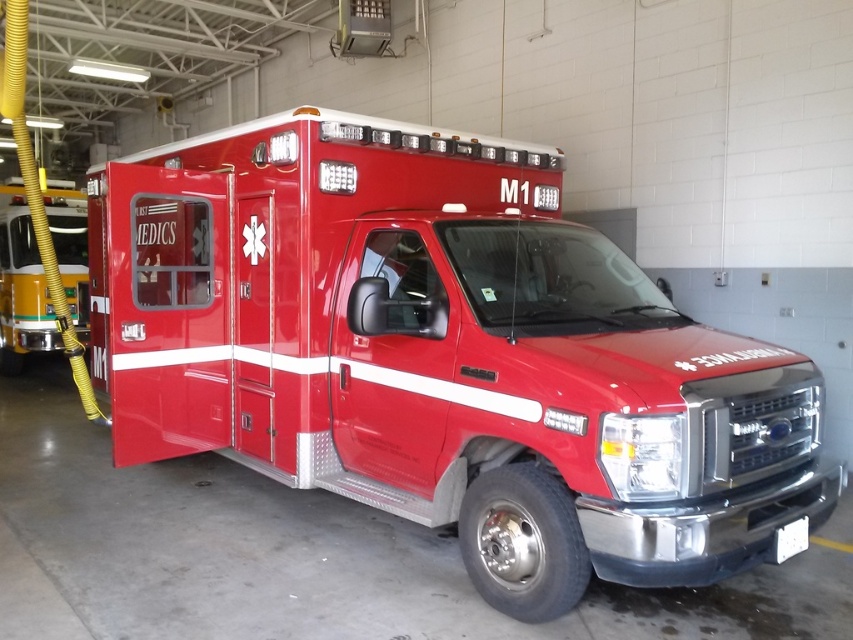
You are a firefighter entering the garage and see the shiny red ambulance at center and the matte yellow hose at left. Which object is closer to the entrance of the garage?

The matte yellow hose at left is closer to the entrance of the garage because the shiny red ambulance at center is to the right of it, meaning the hose is positioned nearer to where you are standing at the entrance.